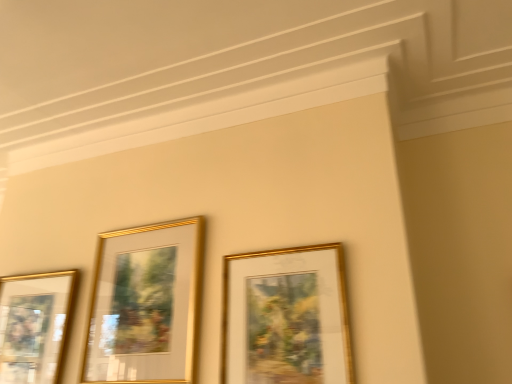
Question: Considering the relative positions of gold metallic picture frame at left, arranged as the third picture frame when viewed from the right, and gold/glossy picture frame at center, the 2th picture frame viewed from the left, in the image provided, is gold metallic picture frame at left, arranged as the third picture frame when viewed from the right, behind gold/glossy picture frame at center, the 2th picture frame viewed from the left,?

Choices:
 (A) no
 (B) yes

Answer: (B)

Question: Is gold/glossy picture frame at center, the 2th picture frame viewed from the left, at the back of gold metallic picture frame at left, arranged as the third picture frame when viewed from the right?

Choices:
 (A) yes
 (B) no

Answer: (B)

Question: From a real-world perspective, is gold metallic picture frame at left, which ranks as the 1th picture frame in left-to-right order, located higher than gold/glossy picture frame at center, which is the 2th picture frame from right to left?

Choices:
 (A) yes
 (B) no

Answer: (B)

Question: Is there a large distance between gold metallic picture frame at left, arranged as the third picture frame when viewed from the right, and gold/glossy picture frame at center, the 2th picture frame viewed from the left?

Choices:
 (A) yes
 (B) no

Answer: (B)

Question: Does gold metallic picture frame at left, which ranks as the 1th picture frame in left-to-right order, appear on the left side of gold/glossy picture frame at center, which is the 2th picture frame from right to left?

Choices:
 (A) yes
 (B) no

Answer: (A)

Question: From a real-world perspective, is gold metallic picture frame at left, arranged as the third picture frame when viewed from the right, beneath gold/glossy picture frame at center, the 2th picture frame viewed from the left?

Choices:
 (A) no
 (B) yes

Answer: (B)

Question: Is gold/glossy picture frame at center, the 2th picture frame viewed from the left, at the left side of gold metallic picture frame at left, which ranks as the 1th picture frame in left-to-right order?

Choices:
 (A) yes
 (B) no

Answer: (B)

Question: From a real-world perspective, is gold/glossy picture frame at center, the 2th picture frame viewed from the left, beneath gold metallic picture frame at left, which ranks as the 1th picture frame in left-to-right order?

Choices:
 (A) no
 (B) yes

Answer: (A)

Question: Does gold/glossy picture frame at center, which is the 2th picture frame from right to left, come in front of gold metallic picture frame at left, which ranks as the 1th picture frame in left-to-right order?

Choices:
 (A) no
 (B) yes

Answer: (B)

Question: Is gold/glossy picture frame at center, the 2th picture frame viewed from the left, far away from gold metallic picture frame at left, which ranks as the 1th picture frame in left-to-right order?

Choices:
 (A) yes
 (B) no

Answer: (B)

Question: Is gold/glossy picture frame at center, which is the 2th picture frame from right to left, completely or partially outside of gold metallic picture frame at left, arranged as the third picture frame when viewed from the right?

Choices:
 (A) no
 (B) yes

Answer: (B)

Question: From the image's perspective, does gold/glossy picture frame at center, the 2th picture frame viewed from the left, appear lower than gold metallic picture frame at left, which ranks as the 1th picture frame in left-to-right order?

Choices:
 (A) yes
 (B) no

Answer: (B)

Question: Would you say gold metallic picture frame at left, arranged as the third picture frame when viewed from the right, contains gold/glossy picture frame at center, the first picture frame in the right-to-left sequence?

Choices:
 (A) yes
 (B) no

Answer: (B)